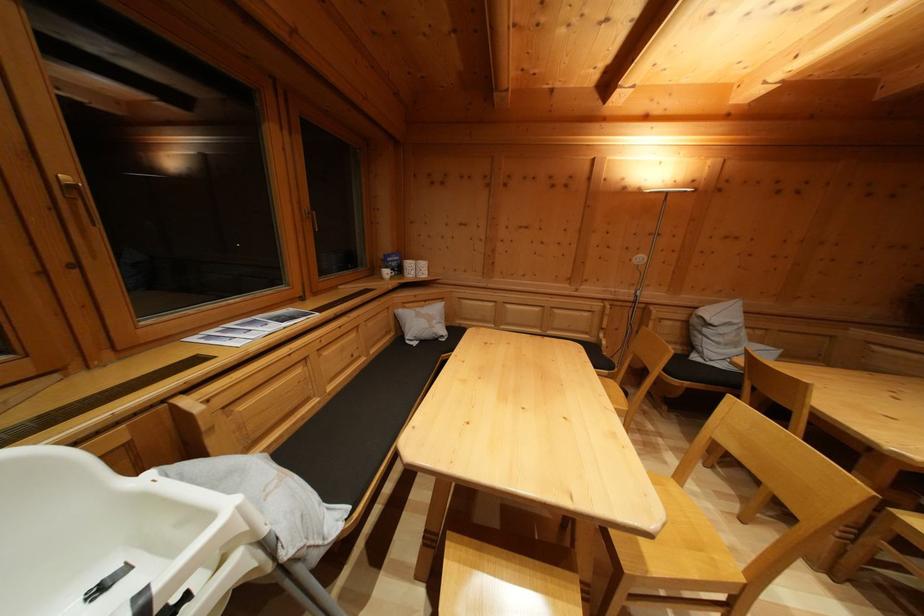
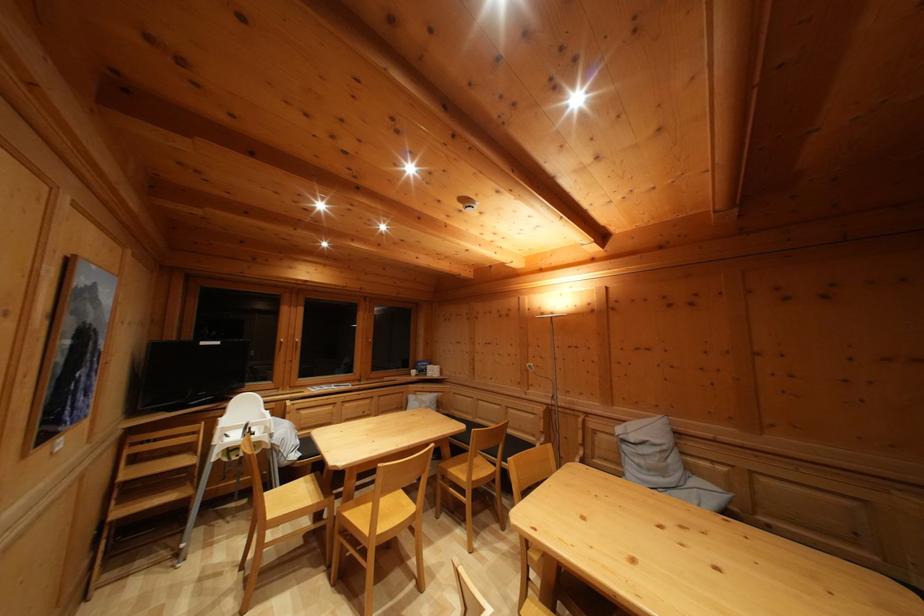
Question: I am providing you with two images of the same scene from different viewpoints. Please identify which objects are invisible in image2.

Choices:
 (A) chair sitting surface
 (B) white mug
 (C) grey cushion
 (D) none of these

Answer: (D)